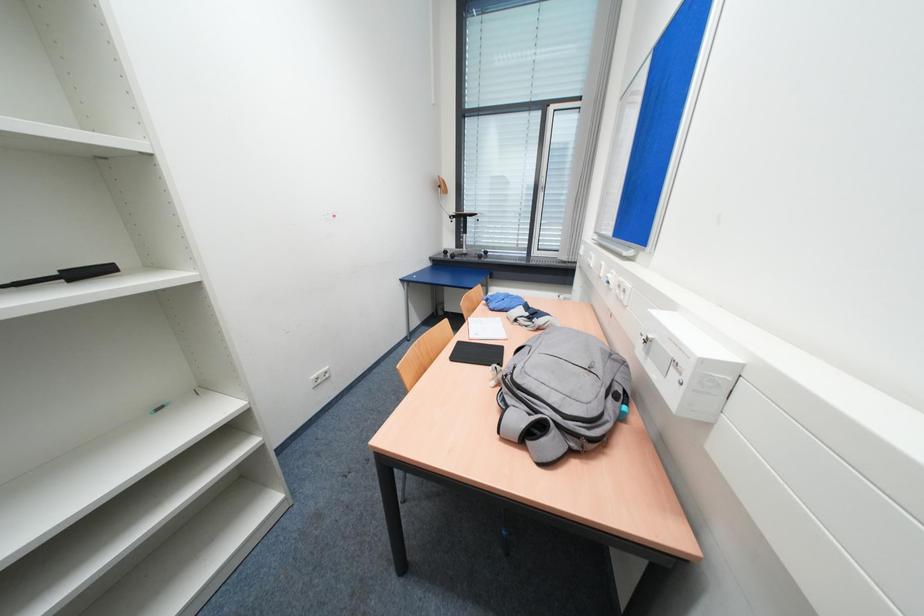
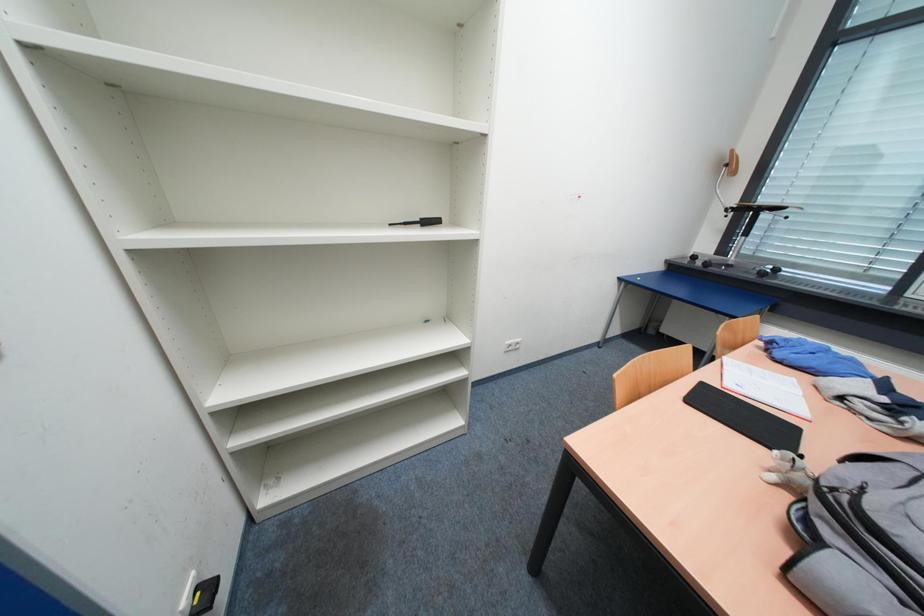
Question: The camera is either moving clockwise (left) or counter-clockwise (right) around the object. The first image is from the beginning of the video and the second image is from the end. Is the camera moving left or right when shooting the video?

Choices:
 (A) Left
 (B) Right

Answer: (B)